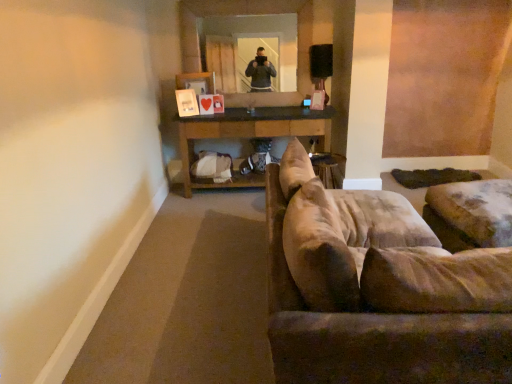
This screenshot has width=512, height=384. What are the coordinates of `clear glass mirror at upper center` in the screenshot? It's located at (259, 45).

What is the approximate height of brown wooden table at center?

It is 33.12 inches.

The width and height of the screenshot is (512, 384). What do you see at coordinates (386, 283) in the screenshot?
I see `suede-like beige couch at right` at bounding box center [386, 283].

Locate an element on the screen. The width and height of the screenshot is (512, 384). clear glass mirror at upper center is located at coordinates (259, 45).

Considering their positions, is clear glass mirror at upper center located in front of or behind brown wooden table at center?

clear glass mirror at upper center is behind brown wooden table at center.

Does clear glass mirror at upper center have a greater width compared to brown wooden table at center?

No.

Based on the photo, could you tell me if clear glass mirror at upper center is turned towards brown wooden table at center?

No, clear glass mirror at upper center does not turn towards brown wooden table at center.

Is suede-like beige couch at right oriented away from clear glass mirror at upper center?

No, clear glass mirror at upper center is not at the back of suede-like beige couch at right.

Relative to clear glass mirror at upper center, is suede-like beige couch at right in front or behind?

suede-like beige couch at right is positioned closer to the viewer than clear glass mirror at upper center.

Which is correct: suede-like beige couch at right is inside clear glass mirror at upper center, or outside of it?

suede-like beige couch at right lies outside clear glass mirror at upper center.

Is suede-like beige couch at right oriented away from brown wooden table at center?

No, suede-like beige couch at right is not facing away from brown wooden table at center.

Is suede-like beige couch at right far from brown wooden table at center?

Yes, suede-like beige couch at right and brown wooden table at center are quite far apart.

Between suede-like beige couch at right and brown wooden table at center, which one has less height?

brown wooden table at center.

From a real-world perspective, is suede-like beige couch at right on brown wooden table at center?

Correct, in the physical world, suede-like beige couch at right is higher than brown wooden table at center.

Considering the relative sizes of clear glass mirror at upper center and suede-like beige couch at right in the image provided, is clear glass mirror at upper center smaller than suede-like beige couch at right?

Correct, clear glass mirror at upper center occupies less space than suede-like beige couch at right.

Find the location of a particular element. This screenshot has width=512, height=384. mirror behind the suede-like beige couch at right is located at coordinates (259, 45).

Is suede-like beige couch at right surrounded by clear glass mirror at upper center?

→ That's incorrect, suede-like beige couch at right is not inside clear glass mirror at upper center.

Between clear glass mirror at upper center and suede-like beige couch at right, which one has less height?

suede-like beige couch at right is shorter.

Can you tell me how much brown wooden table at center and suede-like beige couch at right differ in facing direction?

brown wooden table at center and suede-like beige couch at right are facing 179 degrees away from each other.

From a real-world perspective, which is physically above, brown wooden table at center or suede-like beige couch at right?

suede-like beige couch at right is physically above.

Does brown wooden table at center touch suede-like beige couch at right?

brown wooden table at center and suede-like beige couch at right are clearly separated.

Considering the positions of points (290, 111) and (444, 335), is point (290, 111) farther from camera compared to point (444, 335)?

Yes, it is behind point (444, 335).

Consider the image. Is brown wooden table at center facing towards clear glass mirror at upper center?

No, brown wooden table at center is not facing towards clear glass mirror at upper center.

From a real-world perspective, which is physically below, brown wooden table at center or clear glass mirror at upper center?

brown wooden table at center is physically lower.

Is point (236, 128) positioned behind point (290, 83)?

No, (236, 128) is closer to viewer.

Based on the photo, between brown wooden table at center and clear glass mirror at upper center, which one has larger width?

Wider between the two is brown wooden table at center.

This screenshot has height=384, width=512. In order to click on mirror that appears above the brown wooden table at center (from the image's perspective) in this screenshot , I will do `click(259, 45)`.

The height and width of the screenshot is (384, 512). What are the coordinates of `studio couch below the clear glass mirror at upper center (from a real-world perspective)` in the screenshot? It's located at (386, 283).

Looking at this image, looking at the image, which one is located closer to brown wooden table at center, suede-like beige couch at right or clear glass mirror at upper center?

clear glass mirror at upper center is positioned closer to the anchor brown wooden table at center.

When comparing their distances from brown wooden table at center, does clear glass mirror at upper center or suede-like beige couch at right seem further?

suede-like beige couch at right is further to brown wooden table at center.

Considering their positions, is brown wooden table at center positioned closer to clear glass mirror at upper center than suede-like beige couch at right?

brown wooden table at center is closer to clear glass mirror at upper center.

Which object lies nearer to the anchor point clear glass mirror at upper center, suede-like beige couch at right or brown wooden table at center?

Result: Based on the image, brown wooden table at center appears to be nearer to clear glass mirror at upper center.

Which object lies nearer to the anchor point suede-like beige couch at right, brown wooden table at center or clear glass mirror at upper center?

brown wooden table at center is positioned closer to the anchor suede-like beige couch at right.

Estimate the real-world distances between objects in this image. Which object is closer to suede-like beige couch at right, clear glass mirror at upper center or brown wooden table at center?

brown wooden table at center lies closer to suede-like beige couch at right than the other object.

The image size is (512, 384). Identify the location of table between suede-like beige couch at right and clear glass mirror at upper center from front to back. (248, 135).